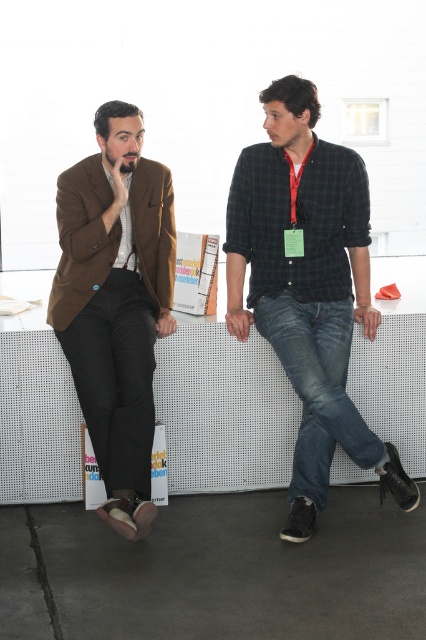
Who is higher up, green plaid shirt at center or denim jeans at center?

green plaid shirt at center

Who is lower down, green plaid shirt at center or denim jeans at center?

denim jeans at center

Is point (273, 125) farther from viewer compared to point (354, 410)?

That is True.

Image resolution: width=426 pixels, height=640 pixels. I want to click on green plaid shirt at center, so click(307, 289).

Can you confirm if green plaid shirt at center is positioned above matte brown blazer at left?

Yes.

Is green plaid shirt at center to the right of matte brown blazer at left from the viewer's perspective?

Yes, green plaid shirt at center is to the right of matte brown blazer at left.

Where is `green plaid shirt at center`? Image resolution: width=426 pixels, height=640 pixels. green plaid shirt at center is located at coordinates (307, 289).

This screenshot has width=426, height=640. I want to click on green plaid shirt at center, so click(x=307, y=289).

Does matte brown blazer at left appear over denim jeans at center?

Indeed, matte brown blazer at left is positioned over denim jeans at center.

This screenshot has width=426, height=640. What do you see at coordinates (115, 301) in the screenshot? I see `matte brown blazer at left` at bounding box center [115, 301].

From the picture: Who is more forward, (83,193) or (310,372)?

Point (310,372) is more forward.

Find the location of a particular element. Image resolution: width=426 pixels, height=640 pixels. matte brown blazer at left is located at coordinates (115, 301).